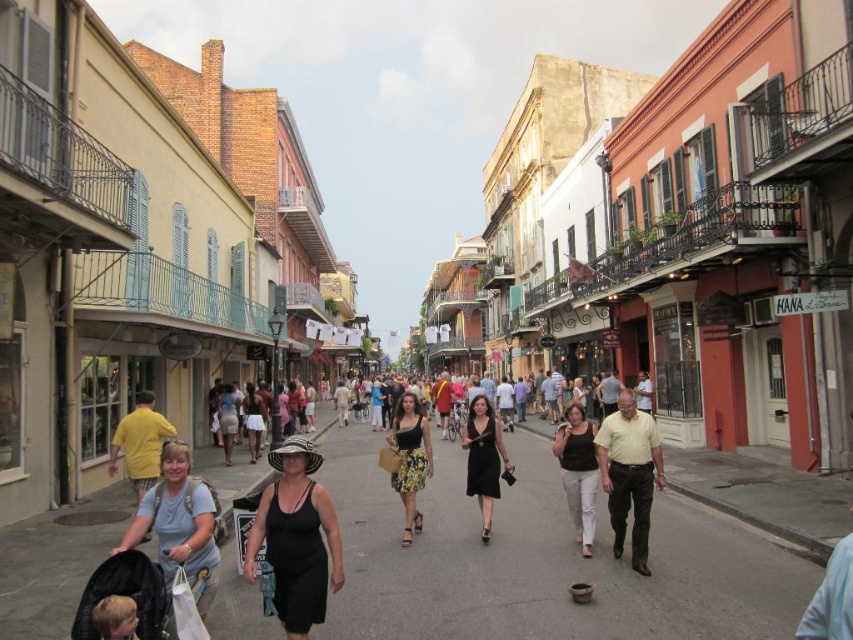
Does point (190, 525) come closer to viewer compared to point (630, 458)?

Yes.

Is blue cotton shirt at lower left closer to the viewer compared to yellow cotton shirt at center?

Yes, blue cotton shirt at lower left is in front of yellow cotton shirt at center.

Which is in front, point (213, 502) or point (618, 522)?

Positioned in front is point (213, 502).

This screenshot has height=640, width=853. I want to click on blue cotton shirt at lower left, so tap(178, 524).

Is yellow cotton shirt at center positioned in front of blonde hair at lower left?

No, it is behind blonde hair at lower left.

Consider the image. Does yellow cotton shirt at center appear on the right side of blonde hair at lower left?

Indeed, yellow cotton shirt at center is positioned on the right side of blonde hair at lower left.

The image size is (853, 640). Find the location of `yellow cotton shirt at center`. yellow cotton shirt at center is located at coordinates (630, 474).

Which is below, black matte dress at center or blue cotton shirt at lower left?

black matte dress at center

Which of these two, black matte dress at center or blue cotton shirt at lower left, stands taller?

black matte dress at center is taller.

Is point (305, 552) farther from camera compared to point (207, 486)?

No, (305, 552) is closer to viewer.

The width and height of the screenshot is (853, 640). In order to click on black matte dress at center in this screenshot , I will do `click(296, 538)`.